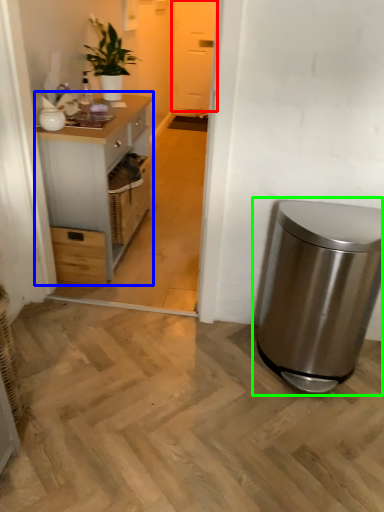
Question: Considering the real-world distances, which object is closest to glass door (highlighted by a red box)? cabinetry (highlighted by a blue box) or waste container (highlighted by a green box).

Choices:
 (A) cabinetry
 (B) waste container

Answer: (A)